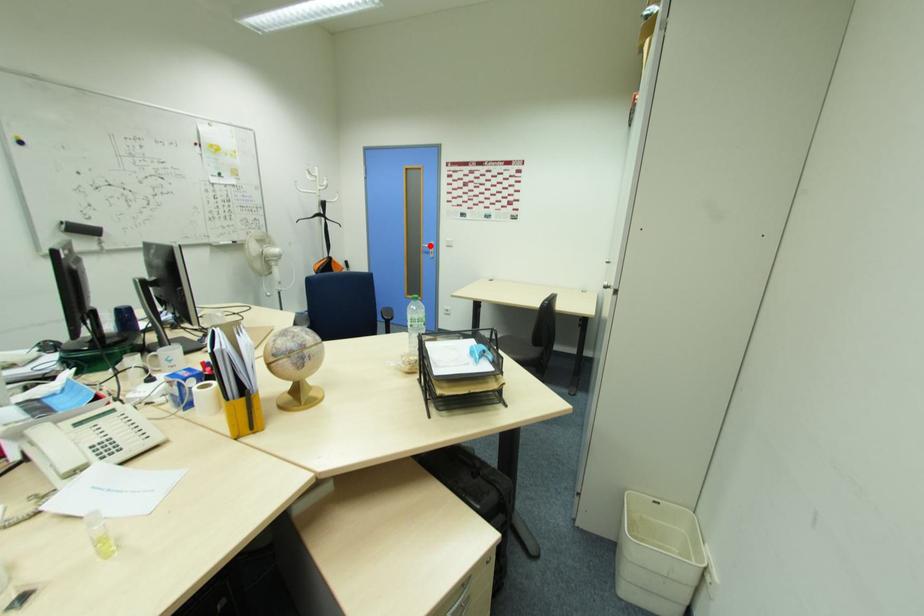
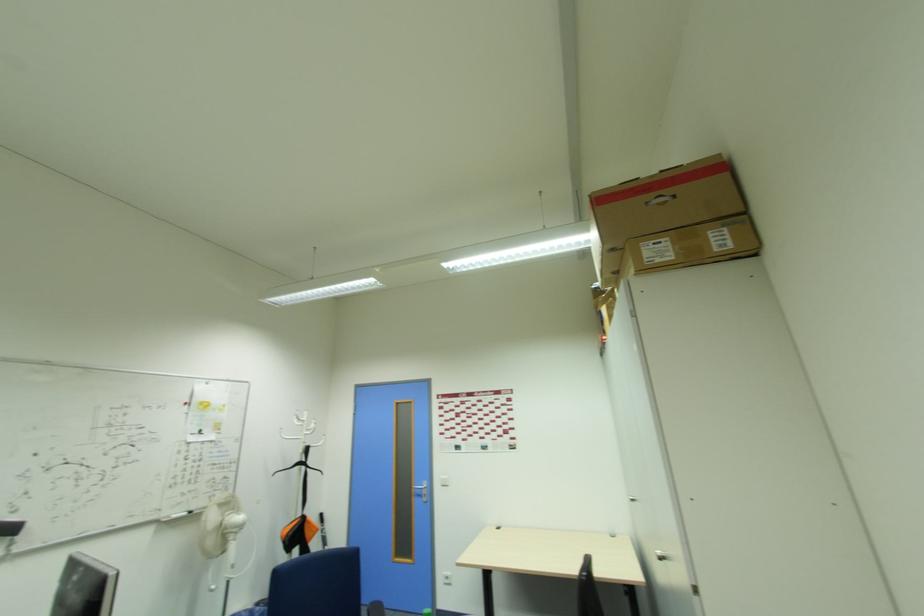
Question: A red point is marked in image1. In image2, is the corresponding 3D point closer to the camera or farther? Reply with the corresponding letter.

Choices:
 (A) The corresponding 3D point is closer.
 (B) The corresponding 3D point is farther.

Answer: (B)